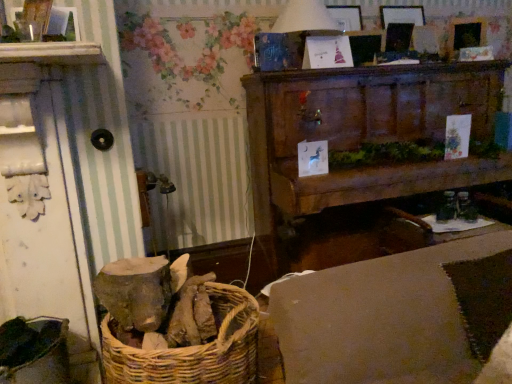
What are the coordinates of `beige fabric couch at lower right` in the screenshot? It's located at (397, 315).

Image resolution: width=512 pixels, height=384 pixels. Describe the element at coordinates (397, 315) in the screenshot. I see `beige fabric couch at lower right` at that location.

The height and width of the screenshot is (384, 512). What do you see at coordinates (303, 27) in the screenshot? I see `white paper lampshade at upper center` at bounding box center [303, 27].

Describe the element at coordinates (364, 136) in the screenshot. The image size is (512, 384). I see `wooden cabinet at upper center` at that location.

Locate an element on the screen. The width and height of the screenshot is (512, 384). beige fabric couch at lower right is located at coordinates (397, 315).

Would you say wooden cabinet at upper center is outside beige fabric couch at lower right?

Yes, wooden cabinet at upper center is not within beige fabric couch at lower right.

Between wooden cabinet at upper center and beige fabric couch at lower right, which one has more height?

With more height is wooden cabinet at upper center.

From the image's perspective, does wooden cabinet at upper center appear lower than beige fabric couch at lower right?

No.

Considering the positions of point (269, 163) and point (409, 273), is point (269, 163) closer or farther from the camera than point (409, 273)?

Point (269, 163) appears to be farther away from the viewer than point (409, 273).

From the image's perspective, which is above, beige fabric couch at lower right or wooden cabinet at upper center?

From the image's view, wooden cabinet at upper center is above.

Can you confirm if beige fabric couch at lower right is shorter than wooden cabinet at upper center?

Yes.

Locate an element on the screen. This screenshot has height=384, width=512. couch that is under the wooden cabinet at upper center (from a real-world perspective) is located at coordinates (397, 315).

From the image's perspective, is wooden cabinet at upper center located beneath white paper lampshade at upper center?

Yes, from the image's perspective, wooden cabinet at upper center is beneath white paper lampshade at upper center.

Is wooden cabinet at upper center far away from white paper lampshade at upper center?

No, wooden cabinet at upper center is not far from white paper lampshade at upper center.

Considering the sizes of wooden cabinet at upper center and white paper lampshade at upper center in the image, is wooden cabinet at upper center taller or shorter than white paper lampshade at upper center?

wooden cabinet at upper center is taller than white paper lampshade at upper center.

Is white paper lampshade at upper center at the left side of wooden cabinet at upper center?

Correct, you'll find white paper lampshade at upper center to the left of wooden cabinet at upper center.

Is white paper lampshade at upper center inside the boundaries of wooden cabinet at upper center, or outside?

white paper lampshade at upper center exists outside the volume of wooden cabinet at upper center.

Is white paper lampshade at upper center further to camera compared to wooden cabinet at upper center?

Yes, white paper lampshade at upper center is behind wooden cabinet at upper center.

Is point (325, 27) closer or farther from the camera than point (502, 70)?

Clearly, point (325, 27) is closer to the camera than point (502, 70).

From a real-world perspective, between beige fabric couch at lower right and white paper lampshade at upper center, who is vertically lower?

In real-world perspective, beige fabric couch at lower right is lower.

Is beige fabric couch at lower right inside or outside of white paper lampshade at upper center?

beige fabric couch at lower right is not enclosed by white paper lampshade at upper center.

Is beige fabric couch at lower right oriented away from white paper lampshade at upper center?

No.

Which of these two, white paper lampshade at upper center or beige fabric couch at lower right, stands shorter?

With less height is white paper lampshade at upper center.

Is white paper lampshade at upper center not inside beige fabric couch at lower right?

Indeed, white paper lampshade at upper center is completely outside beige fabric couch at lower right.

Does point (292, 10) come closer to viewer compared to point (439, 336)?

No, (292, 10) is behind (439, 336).

Which object is thinner, white paper lampshade at upper center or beige fabric couch at lower right?

With smaller width is white paper lampshade at upper center.

At what (x,y) coordinates should I click in order to perform the action: click on furniture lying on the right of beige fabric couch at lower right. Please return your answer as a coordinate pair (x, y). Looking at the image, I should click on (364, 136).

The width and height of the screenshot is (512, 384). What are the coordinates of `couch that appears in front of the wooden cabinet at upper center` in the screenshot? It's located at (397, 315).

Based on their spatial positions, is beige fabric couch at lower right or wooden cabinet at upper center closer to white paper lampshade at upper center?

Among the two, wooden cabinet at upper center is located nearer to white paper lampshade at upper center.

Based on their spatial positions, is wooden cabinet at upper center or white paper lampshade at upper center closer to beige fabric couch at lower right?

Based on the image, wooden cabinet at upper center appears to be nearer to beige fabric couch at lower right.

Based on their spatial positions, is wooden cabinet at upper center or beige fabric couch at lower right further from white paper lampshade at upper center?

beige fabric couch at lower right is positioned further to the anchor white paper lampshade at upper center.

From the image, which object appears to be farther from beige fabric couch at lower right, white paper lampshade at upper center or wooden cabinet at upper center?

white paper lampshade at upper center is further to beige fabric couch at lower right.

Considering their positions, is white paper lampshade at upper center positioned further to wooden cabinet at upper center than beige fabric couch at lower right?

The object further to wooden cabinet at upper center is beige fabric couch at lower right.

Estimate the real-world distances between objects in this image. Which object is closer to wooden cabinet at upper center, beige fabric couch at lower right or white paper lampshade at upper center?

The object closer to wooden cabinet at upper center is white paper lampshade at upper center.

Identify the location of furniture positioned between beige fabric couch at lower right and white paper lampshade at upper center from near to far. The width and height of the screenshot is (512, 384). (364, 136).